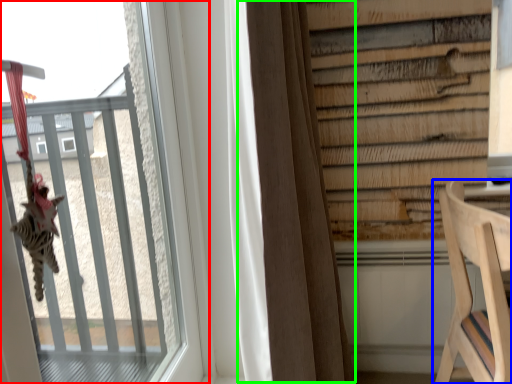
Question: Which object is the farthest from window (highlighted by a red box)? Choose among these: furniture (highlighted by a blue box) or curtain (highlighted by a green box).

Choices:
 (A) furniture
 (B) curtain

Answer: (A)